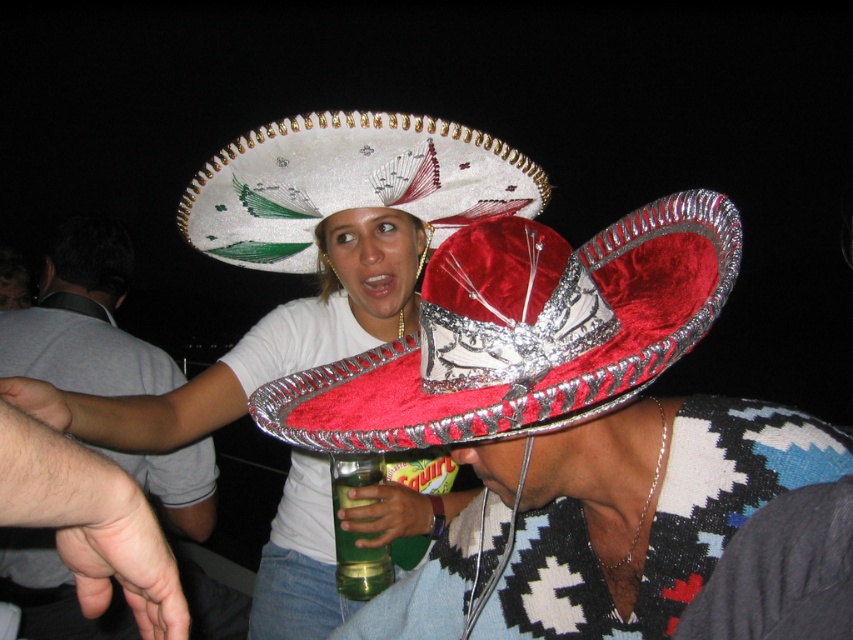
You are at a festive event and want to take a photo of the person in the foreground wearing the vibrant red sombrero with silver trim and a white band featuring intricate designs. If you move 10 inches closer to the point at coordinates point (x=567, y=332), will you be within 20 inches of them?

The point at coordinates point (x=567, y=332) is 28.76 inches away from the camera. Moving 10 inches closer would bring you to 18.76 inches away, which is within 20 inches of them.

You are at a festive event and want to locate the velvet red sombrero at center. According to the coordinates given, where would you find it?

The velvet red sombrero at center is located at coordinates point (x=521, y=332).